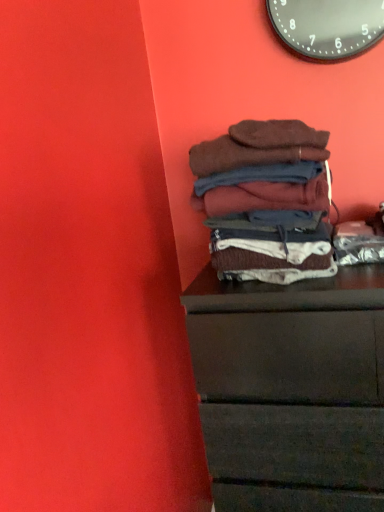
Locate an element on the screen. dark wood chest of drawers at lower right is located at coordinates [x=291, y=390].

At what (x,y) coordinates should I click in order to perform the action: click on black metallic clock at upper center. Please return your answer as a coordinate pair (x, y). Looking at the image, I should click on (327, 26).

Describe the element at coordinates (266, 200) in the screenshot. The height and width of the screenshot is (512, 384). I see `brown soft fabric at center` at that location.

You are a GUI agent. You are given a task and a screenshot of the screen. Output one action in this format:
    pyautogui.click(x=<x>, y=<y>)
    Task: Click on the dark wood chest of drawers at lower right
    This screenshot has width=384, height=512.
    Given the screenshot: What is the action you would take?
    pyautogui.click(x=291, y=390)

Locate an element on the screen. The width and height of the screenshot is (384, 512). wall clock located above the brown soft fabric at center (from the image's perspective) is located at coordinates (327, 26).

Between point (317, 44) and point (284, 231), which one is positioned behind?

The point (317, 44) is behind.

Considering their positions, is black metallic clock at upper center located in front of or behind brown soft fabric at center?

Clearly, black metallic clock at upper center is behind brown soft fabric at center.

Measure the distance from black metallic clock at upper center to brown soft fabric at center.

black metallic clock at upper center is 51.49 centimeters away from brown soft fabric at center.

Is black metallic clock at upper center next to dark wood chest of drawers at lower right?

There is a gap between black metallic clock at upper center and dark wood chest of drawers at lower right.

Consider the image. Measure the distance from black metallic clock at upper center to dark wood chest of drawers at lower right.

black metallic clock at upper center is 34.62 inches from dark wood chest of drawers at lower right.

From the image's perspective, which one is positioned higher, black metallic clock at upper center or dark wood chest of drawers at lower right?

black metallic clock at upper center.

Which is in front, point (294, 23) or point (267, 292)?

The point (267, 292) is closer.

From the image's perspective, which is below, brown soft fabric at center or dark wood chest of drawers at lower right?

A: dark wood chest of drawers at lower right, from the image's perspective.

Looking at this image, is brown soft fabric at center smaller than dark wood chest of drawers at lower right?

Correct, brown soft fabric at center occupies less space than dark wood chest of drawers at lower right.

Where is `material above the dark wood chest of drawers at lower right (from a real-world perspective)`? material above the dark wood chest of drawers at lower right (from a real-world perspective) is located at coordinates (266, 200).

From a real-world perspective, between brown soft fabric at center and dark wood chest of drawers at lower right, who is vertically higher?

brown soft fabric at center, from a real-world perspective.

Measure the distance between dark wood chest of drawers at lower right and black metallic clock at upper center.

A distance of 34.62 inches exists between dark wood chest of drawers at lower right and black metallic clock at upper center.

Is dark wood chest of drawers at lower right thinner than black metallic clock at upper center?

Incorrect, the width of dark wood chest of drawers at lower right is not less than that of black metallic clock at upper center.

Between point (261, 391) and point (359, 18), which one is positioned behind?

The point (359, 18) is farther.

Are dark wood chest of drawers at lower right and black metallic clock at upper center located far from each other?

That's not correct — dark wood chest of drawers at lower right is a little close to black metallic clock at upper center.

Does dark wood chest of drawers at lower right appear on the left side of brown soft fabric at center?

Incorrect, dark wood chest of drawers at lower right is not on the left side of brown soft fabric at center.

Which object is more forward, dark wood chest of drawers at lower right or brown soft fabric at center?

dark wood chest of drawers at lower right is more forward.

Consider the image. From the image's perspective, between dark wood chest of drawers at lower right and brown soft fabric at center, which one is located above?

brown soft fabric at center.

Which point is more forward, [272,500] or [293,182]?

Positioned in front is point [293,182].

Is brown soft fabric at center next to black metallic clock at upper center?

No, brown soft fabric at center is not with black metallic clock at upper center.

Considering the positions of objects brown soft fabric at center and black metallic clock at upper center in the image provided, who is more to the left, brown soft fabric at center or black metallic clock at upper center?

brown soft fabric at center.

Can you confirm if brown soft fabric at center is bigger than black metallic clock at upper center?

Yes, brown soft fabric at center is bigger than black metallic clock at upper center.

From a real-world perspective, between brown soft fabric at center and black metallic clock at upper center, who is vertically lower?

brown soft fabric at center, from a real-world perspective.

Identify the location of material on the left of black metallic clock at upper center. (266, 200).

Locate an element on the screen. The width and height of the screenshot is (384, 512). chest of drawers below the black metallic clock at upper center (from a real-world perspective) is located at coordinates (291, 390).

Based on the photo, which object lies nearer to the anchor point dark wood chest of drawers at lower right, brown soft fabric at center or black metallic clock at upper center?

brown soft fabric at center is positioned closer to the anchor dark wood chest of drawers at lower right.

From the image, which object appears to be farther from dark wood chest of drawers at lower right, black metallic clock at upper center or brown soft fabric at center?

The object further to dark wood chest of drawers at lower right is black metallic clock at upper center.

Based on their spatial positions, is black metallic clock at upper center or dark wood chest of drawers at lower right closer to brown soft fabric at center?

dark wood chest of drawers at lower right is closer to brown soft fabric at center.

Based on their spatial positions, is dark wood chest of drawers at lower right or black metallic clock at upper center further from brown soft fabric at center?

The object further to brown soft fabric at center is black metallic clock at upper center.

Estimate the real-world distances between objects in this image. Which object is closer to black metallic clock at upper center, brown soft fabric at center or dark wood chest of drawers at lower right?

brown soft fabric at center is positioned closer to the anchor black metallic clock at upper center.

Considering their positions, is dark wood chest of drawers at lower right positioned further to black metallic clock at upper center than brown soft fabric at center?

Based on the image, dark wood chest of drawers at lower right appears to be further to black metallic clock at upper center.

Locate an element on the screen. The width and height of the screenshot is (384, 512). material between black metallic clock at upper center and dark wood chest of drawers at lower right in the vertical direction is located at coordinates (266, 200).